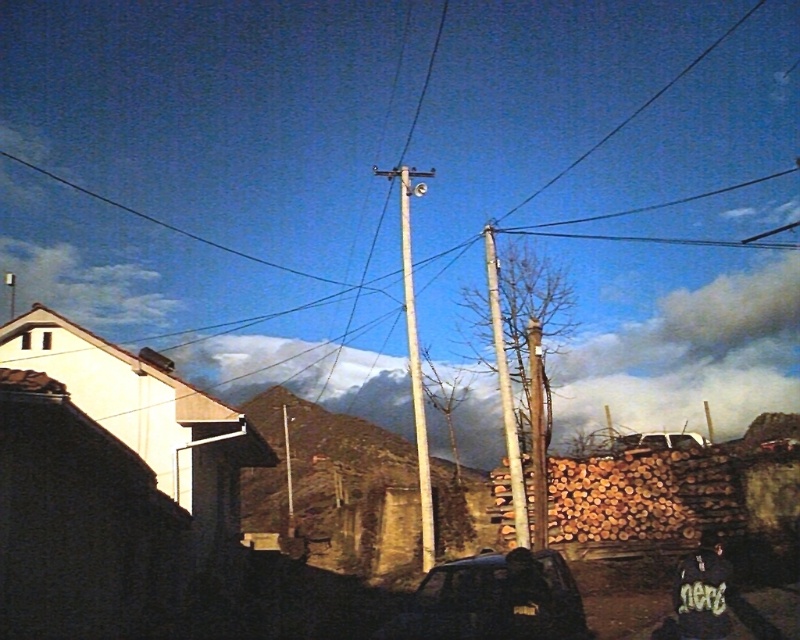
Who is taller, smooth wood telegraph pole at center or white matte car at center?

With more height is smooth wood telegraph pole at center.

What are the coordinates of `smooth wood telegraph pole at center` in the screenshot? It's located at (505, 394).

Does point (444, 586) lie behind point (680, 588)?

Yes, point (444, 586) is farther from viewer.

Is dark matte car at center bigger than dark fabric shirt at lower right?

No.

Does point (462, 570) come behind point (700, 545)?

No, it is not.

This screenshot has width=800, height=640. Find the location of `dark matte car at center`. dark matte car at center is located at coordinates (492, 602).

Is smooth wooden telegraph pole at center wider than smooth wood telegraph pole at center?

No.

Is smooth wooden telegraph pole at center above smooth wood telegraph pole at center?

Indeed, smooth wooden telegraph pole at center is positioned over smooth wood telegraph pole at center.

In order to click on smooth wooden telegraph pole at center in this screenshot , I will do `click(416, 356)`.